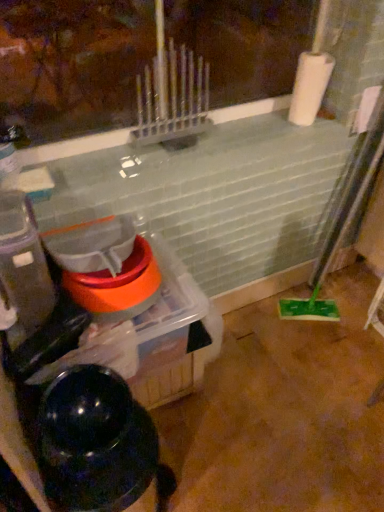
Question: Can you confirm if black glossy water heater at lower left is wider than white matte paper towel at upper right?

Choices:
 (A) no
 (B) yes

Answer: (B)

Question: Considering the relative sizes of black glossy water heater at lower left and white matte paper towel at upper right in the image provided, is black glossy water heater at lower left shorter than white matte paper towel at upper right?

Choices:
 (A) no
 (B) yes

Answer: (A)

Question: Considering the relative sizes of black glossy water heater at lower left and white matte paper towel at upper right in the image provided, is black glossy water heater at lower left smaller than white matte paper towel at upper right?

Choices:
 (A) yes
 (B) no

Answer: (B)

Question: Does black glossy water heater at lower left come in front of white matte paper towel at upper right?

Choices:
 (A) yes
 (B) no

Answer: (A)

Question: Does black glossy water heater at lower left have a greater height compared to white matte paper towel at upper right?

Choices:
 (A) no
 (B) yes

Answer: (B)

Question: Is black glossy water heater at lower left to the right of white matte paper towel at upper right from the viewer's perspective?

Choices:
 (A) no
 (B) yes

Answer: (A)

Question: Could you tell me if white matte paper towel at upper right is facing translucent plastic container at left?

Choices:
 (A) yes
 (B) no

Answer: (B)

Question: From the image's perspective, would you say white matte paper towel at upper right is positioned over translucent plastic container at left?

Choices:
 (A) yes
 (B) no

Answer: (A)

Question: Considering the relative sizes of white matte paper towel at upper right and translucent plastic container at left in the image provided, is white matte paper towel at upper right bigger than translucent plastic container at left?

Choices:
 (A) no
 (B) yes

Answer: (A)

Question: Does white matte paper towel at upper right have a greater width compared to translucent plastic container at left?

Choices:
 (A) yes
 (B) no

Answer: (B)

Question: Does white matte paper towel at upper right have a lesser height compared to translucent plastic container at left?

Choices:
 (A) no
 (B) yes

Answer: (B)

Question: Is white matte paper towel at upper right behind translucent plastic container at left?

Choices:
 (A) no
 (B) yes

Answer: (B)

Question: Is black glossy water heater at lower left not near translucent plastic container at left?

Choices:
 (A) yes
 (B) no

Answer: (B)